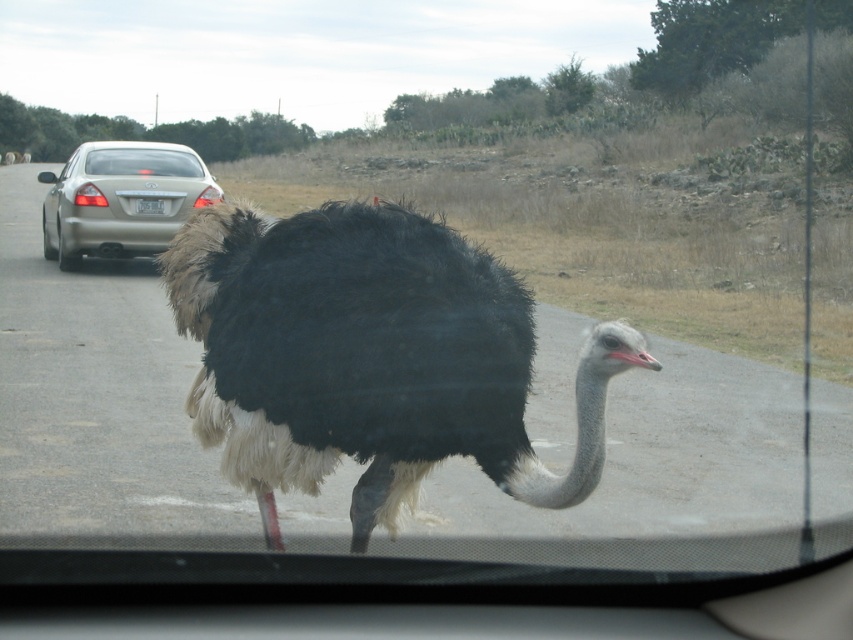
You are a passenger in the car and notice the black feathered ostrich at center and the metallic gold sedan at left. Which object is closer to you?

The black feathered ostrich at center is closer to you because it is positioned under the metallic gold sedan at left, indicating it is in front of the car in the line of sight.

You are driving a car and see the black feathered ostrich at center and the metallic gold sedan at left. Which one is narrower?

The black feathered ostrich at center is thinner than the metallic gold sedan at left, so the black feathered ostrich at center is narrower.

You are a passenger in the car and notice the black feathered ostrich at center and the metallic gold sedan at left. Which object is taller when viewed from your seat?

The metallic gold sedan at left is taller than the black feathered ostrich at center.